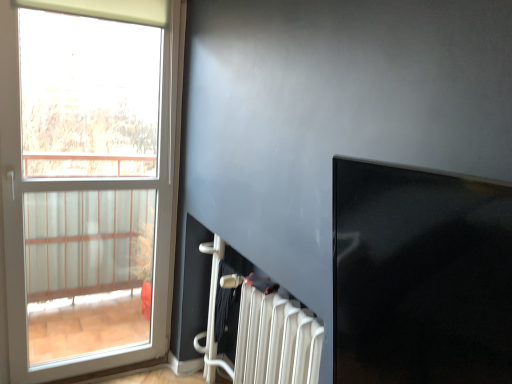
What is the approximate height of transparent glass window screen at upper right?

23.05 inches.

Find the location of a particular element. The image size is (512, 384). white plastic radiator at lower center is located at coordinates (276, 341).

What do you see at coordinates (88, 181) in the screenshot? This screenshot has height=384, width=512. I see `white glass window at left` at bounding box center [88, 181].

You are a GUI agent. You are given a task and a screenshot of the screen. Output one action in this format:
    pyautogui.click(x=<x>, y=<y>)
    Task: Click on the transparent glass window screen at upper right
    
    Given the screenshot: What is the action you would take?
    pyautogui.click(x=420, y=276)

Would you say transparent glass window screen at upper right is a long distance from white plastic radiator at lower center?

transparent glass window screen at upper right is near white plastic radiator at lower center, not far away.

Could you measure the distance between transparent glass window screen at upper right and white plastic radiator at lower center?

The distance of transparent glass window screen at upper right from white plastic radiator at lower center is 28.89 inches.

Is point (511, 229) closer to camera compared to point (279, 350)?

That is True.

Is transparent glass window screen at upper right positioned with its back to white plastic radiator at lower center?

No, transparent glass window screen at upper right is not facing the opposite direction of white plastic radiator at lower center.

Is white glass window at left turned away from transparent glass window screen at upper right?

That's not correct — white glass window at left is not looking away from transparent glass window screen at upper right.

From the picture: Choose the correct answer: Is white glass window at left inside transparent glass window screen at upper right or outside it?

white glass window at left is outside transparent glass window screen at upper right.

Measure the distance between white glass window at left and transparent glass window screen at upper right.

1.64 meters.

From the image's perspective, is white glass window at left over transparent glass window screen at upper right?

Yes.

Is white plastic radiator at lower center touching transparent glass window screen at upper right?

No.

Does white plastic radiator at lower center have a larger size compared to transparent glass window screen at upper right?

Indeed, white plastic radiator at lower center has a larger size compared to transparent glass window screen at upper right.

Which of these two, white plastic radiator at lower center or transparent glass window screen at upper right, is thinner?

With smaller width is white plastic radiator at lower center.

Is white plastic radiator at lower center shorter than transparent glass window screen at upper right?

Incorrect, the height of white plastic radiator at lower center does not fall short of that of transparent glass window screen at upper right.

Is white glass window at left positioned behind white plastic radiator at lower center?

Yes, the depth of white glass window at left is greater than that of white plastic radiator at lower center.

Is white glass window at left not within white plastic radiator at lower center?

Yes, white glass window at left is located beyond the bounds of white plastic radiator at lower center.

Is point (96, 284) positioned before point (302, 380)?

No, it is behind (302, 380).

How different are the orientations of white glass window at left and white plastic radiator at lower center in degrees?

The angle between the facing direction of white glass window at left and the facing direction of white plastic radiator at lower center is 87.7 degrees.

You are a GUI agent. You are given a task and a screenshot of the screen. Output one action in this format:
    pyautogui.click(x=<x>, y=<y>)
    Task: Click on the radiator in front of the white glass window at left
    
    Given the screenshot: What is the action you would take?
    pyautogui.click(x=276, y=341)

From a real-world perspective, is white plastic radiator at lower center under white glass window at left?

Indeed, from a real-world perspective, white plastic radiator at lower center is positioned beneath white glass window at left.

How many degrees apart are the facing directions of white plastic radiator at lower center and white glass window at left?

The angle between the facing direction of white plastic radiator at lower center and the facing direction of white glass window at left is 87.7 degrees.

Measure the distance from transparent glass window screen at upper right to white glass window at left.

The distance of transparent glass window screen at upper right from white glass window at left is 5.37 feet.

In order to click on window behind the transparent glass window screen at upper right in this screenshot , I will do [x=88, y=181].

Does point (474, 294) come farther from viewer compared to point (90, 252)?

No, it is in front of (90, 252).

From the image's perspective, which one is positioned higher, transparent glass window screen at upper right or white glass window at left?

white glass window at left appears higher in the image.

Find the location of a particular element. The height and width of the screenshot is (384, 512). window screen that is above the white plastic radiator at lower center (from a real-world perspective) is located at coordinates (420, 276).

In the image, there is a transparent glass window screen at upper right. Where is `window below it (from a real-world perspective)`? window below it (from a real-world perspective) is located at coordinates (88, 181).

In the scene shown: From the image, which object appears to be nearer to white glass window at left, white plastic radiator at lower center or transparent glass window screen at upper right?

white plastic radiator at lower center.

Considering their positions, is transparent glass window screen at upper right positioned further to white plastic radiator at lower center than white glass window at left?

Among the two, white glass window at left is located further to white plastic radiator at lower center.

When comparing their distances from white glass window at left, does transparent glass window screen at upper right or white plastic radiator at lower center seem closer?

white plastic radiator at lower center is positioned closer to the anchor white glass window at left.

In the scene shown: When comparing their distances from white plastic radiator at lower center, does white glass window at left or transparent glass window screen at upper right seem further?

Among the two, white glass window at left is located further to white plastic radiator at lower center.

Which object lies nearer to the anchor point transparent glass window screen at upper right, white glass window at left or white plastic radiator at lower center?

white plastic radiator at lower center lies closer to transparent glass window screen at upper right than the other object.

From the picture: From the image, which object appears to be farther from transparent glass window screen at upper right, white plastic radiator at lower center or white glass window at left?

white glass window at left.

Where is `radiator between transparent glass window screen at upper right and white glass window at left from front to back`? radiator between transparent glass window screen at upper right and white glass window at left from front to back is located at coordinates (276, 341).